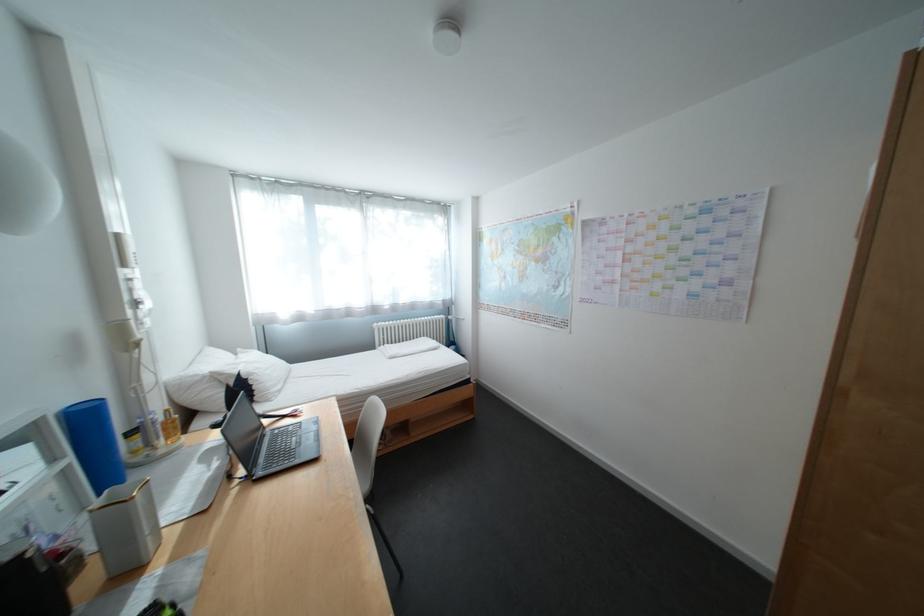
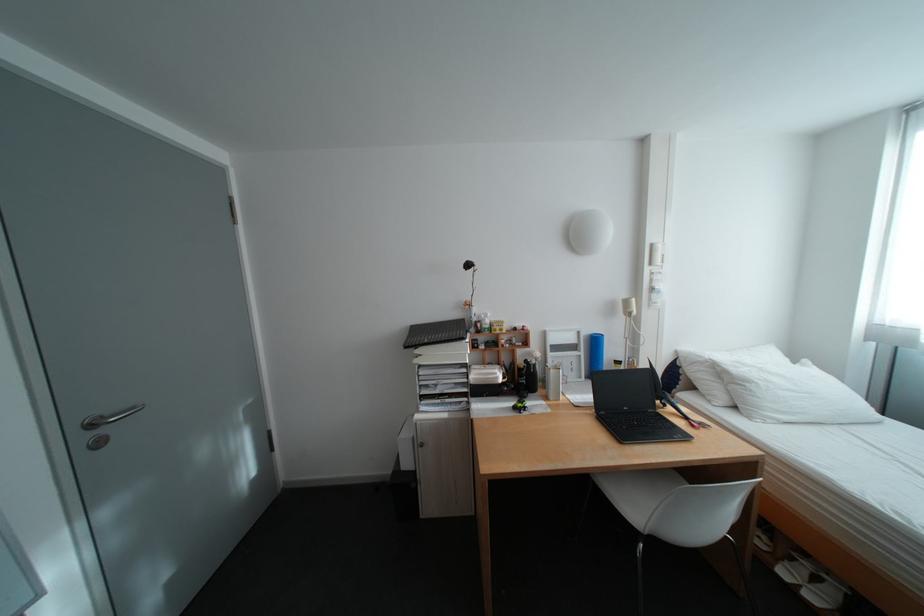
The point at (129,237) is marked in the first image. Where is the corresponding point in the second image?

(664, 246)